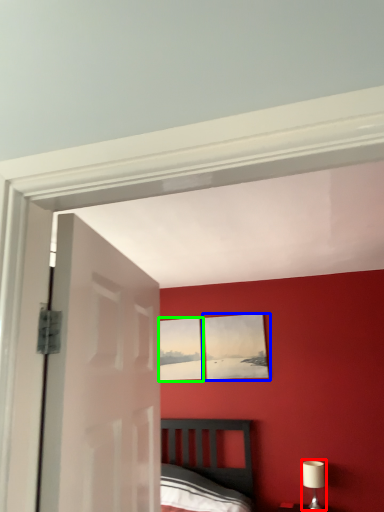
Question: Considering the real-world distances, which object is closest to table lamp (highlighted by a red box)? picture frame (highlighted by a blue box) or picture frame (highlighted by a green box).

Choices:
 (A) picture frame
 (B) picture frame

Answer: (A)